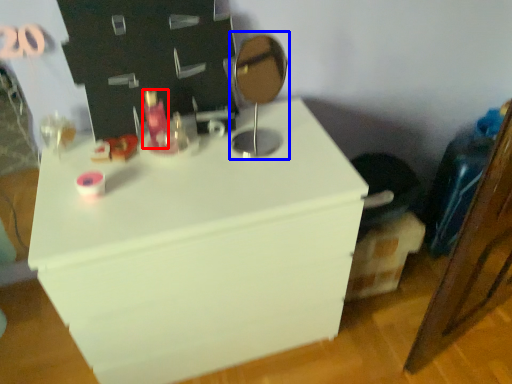
Question: Which object is closer to the camera taking this photo, toiletry (highlighted by a red box) or table lamp (highlighted by a blue box)?

Choices:
 (A) toiletry
 (B) table lamp

Answer: (B)